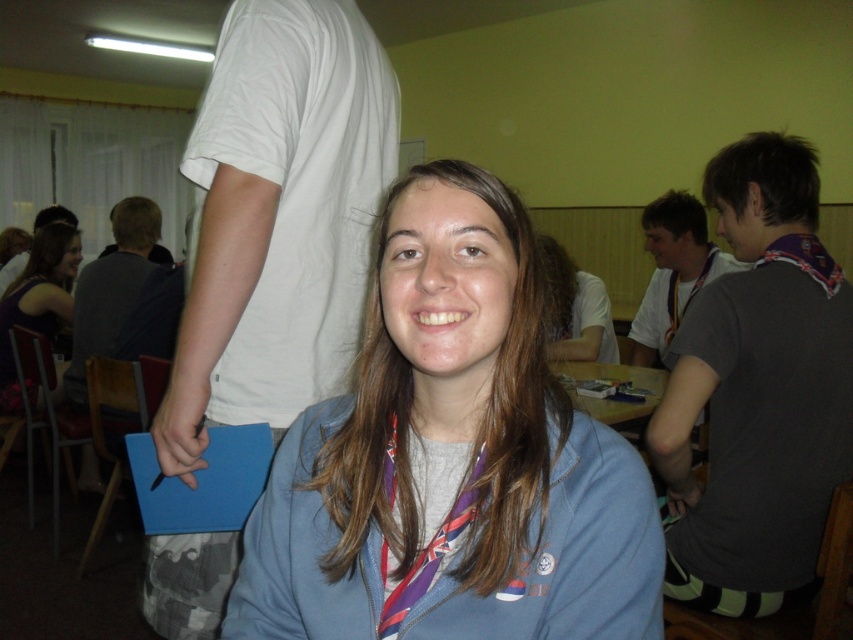
Between point (178, 616) and point (619, 365), which one is positioned in front?

Point (178, 616) is more forward.

I want to click on white cotton t-shirt at upper left, so click(277, 218).

Is dark gray t-shirt at right to the left of gray fabric shirt at upper right from the viewer's perspective?

Indeed, dark gray t-shirt at right is positioned on the left side of gray fabric shirt at upper right.

Is dark gray t-shirt at right positioned behind gray fabric shirt at upper right?

No, it is in front of gray fabric shirt at upper right.

Does point (724, 500) lie in front of point (682, 196)?

Yes, point (724, 500) is in front of point (682, 196).

Image resolution: width=853 pixels, height=640 pixels. I want to click on dark gray t-shirt at right, so click(757, 392).

Is blue fleece jacket at center positioned in front of purple silk scarf at center?

Yes, it is in front of purple silk scarf at center.

Between blue fleece jacket at center and purple silk scarf at center, which one has less height?

Standing shorter between the two is purple silk scarf at center.

The image size is (853, 640). What do you see at coordinates (451, 468) in the screenshot? I see `blue fleece jacket at center` at bounding box center [451, 468].

I want to click on blue fleece jacket at center, so click(x=451, y=468).